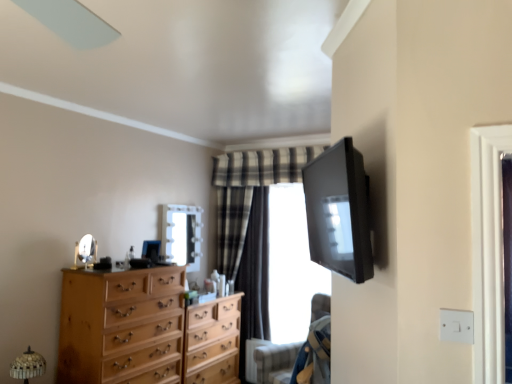
What do you see at coordinates (275, 362) in the screenshot? The image size is (512, 384). I see `denim fabric armchair at lower right` at bounding box center [275, 362].

What do you see at coordinates (339, 211) in the screenshot? I see `matte black tv at upper right` at bounding box center [339, 211].

The image size is (512, 384). What do you see at coordinates (122, 326) in the screenshot?
I see `wooden dresser at left, which is the 1th chest of drawers in front-to-back order` at bounding box center [122, 326].

This screenshot has height=384, width=512. I want to click on clear glass window at center, so (x=291, y=265).

The width and height of the screenshot is (512, 384). What do you see at coordinates (255, 270) in the screenshot? I see `plaid fabric curtain at center` at bounding box center [255, 270].

Find the location of `silver/metallic mirror at center-left, which is the 2th mirror in back-to-front order`. silver/metallic mirror at center-left, which is the 2th mirror in back-to-front order is located at coordinates [x=87, y=249].

Find the location of `curtain located above the light wood chest of drawers at center, the second chest of drawers in the front-to-back sequence (from the image's perspective)`. curtain located above the light wood chest of drawers at center, the second chest of drawers in the front-to-back sequence (from the image's perspective) is located at coordinates (255, 270).

Is plaid fabric curtain at center in contact with light wood chest of drawers at center, the second chest of drawers in the front-to-back sequence?

There is a gap between plaid fabric curtain at center and light wood chest of drawers at center, the second chest of drawers in the front-to-back sequence.

In the scene shown: Is plaid fabric curtain at center smaller than light wood chest of drawers at center, positioned as the first chest of drawers in back-to-front order?

Yes.

How different are the orientations of plaid fabric curtain at center and light wood chest of drawers at center, the second chest of drawers in the front-to-back sequence, in degrees?

The facing directions of plaid fabric curtain at center and light wood chest of drawers at center, the second chest of drawers in the front-to-back sequence, are 92.1 degrees apart.

Can you confirm if matte glass mirror at center, which is counted as the first mirror, starting from the back, is positioned to the left of plaid fabric curtain at center?

Correct, you'll find matte glass mirror at center, which is counted as the first mirror, starting from the back, to the left of plaid fabric curtain at center.

Considering the sizes of objects matte glass mirror at center, arranged as the first mirror when viewed from the right, and plaid fabric curtain at center in the image provided, who is smaller, matte glass mirror at center, arranged as the first mirror when viewed from the right, or plaid fabric curtain at center?

matte glass mirror at center, arranged as the first mirror when viewed from the right.

Is matte glass mirror at center, arranged as the first mirror when viewed from the right, located outside plaid fabric curtain at center?

Yes, matte glass mirror at center, arranged as the first mirror when viewed from the right, is not within plaid fabric curtain at center.

From a real-world perspective, which object stands above the other?

matte glass mirror at center, which is counted as the first mirror, starting from the back, is physically above.

From the image's perspective, is denim fabric armchair at lower right located above clear glass window at center?

Incorrect, from the image's perspective, denim fabric armchair at lower right is lower than clear glass window at center.

Are denim fabric armchair at lower right and clear glass window at center located far from each other?

No, denim fabric armchair at lower right is not far away from clear glass window at center.

Is point (319, 312) farther from viewer compared to point (318, 275)?

No, (319, 312) is in front of (318, 275).

Is clear glass window at center at the back of denim fabric armchair at lower right?

That's not correct — denim fabric armchair at lower right is not looking away from clear glass window at center.

What's the angular difference between denim fabric armchair at lower right and wooden dresser at left, the second chest of drawers viewed from the back,'s facing directions?

They differ by 178 degrees in their facing directions.

Measure the distance between denim fabric armchair at lower right and wooden dresser at left, the second chest of drawers viewed from the back.

denim fabric armchair at lower right is 3.53 feet away from wooden dresser at left, the second chest of drawers viewed from the back.

Can you confirm if denim fabric armchair at lower right is positioned to the left of wooden dresser at left, which is the 1th chest of drawers in front-to-back order?

In fact, denim fabric armchair at lower right is to the right of wooden dresser at left, which is the 1th chest of drawers in front-to-back order.

Between denim fabric armchair at lower right and wooden dresser at left, which is the 1th chest of drawers in front-to-back order, which one has larger width?

wooden dresser at left, which is the 1th chest of drawers in front-to-back order.

From a real-world perspective, is plaid fabric curtain at center positioned above or below silver/metallic mirror at center-left, the second mirror when ordered from right to left?

plaid fabric curtain at center is situated lower than silver/metallic mirror at center-left, the second mirror when ordered from right to left, in the real world.

Is plaid fabric curtain at center closer to camera compared to silver/metallic mirror at center-left, which is the 2th mirror in back-to-front order?

That is False.

In the scene shown: Can you confirm if plaid fabric curtain at center is wider than silver/metallic mirror at center-left, which is the 2th mirror in back-to-front order?

Indeed, plaid fabric curtain at center has a greater width compared to silver/metallic mirror at center-left, which is the 2th mirror in back-to-front order.

Would you say plaid fabric curtain at center is to the left or to the right of silver/metallic mirror at center-left, the second mirror when ordered from right to left, in the picture?

plaid fabric curtain at center is positioned on silver/metallic mirror at center-left, the second mirror when ordered from right to left,'s right side.

Would you say plaid fabric curtain at center is a long distance from matte glass mirror at center, the 2th mirror positioned from the front?

No, plaid fabric curtain at center is in close proximity to matte glass mirror at center, the 2th mirror positioned from the front.

From their relative heights in the image, would you say plaid fabric curtain at center is taller or shorter than matte glass mirror at center, the 2th mirror positioned from the front?

Clearly, plaid fabric curtain at center is taller compared to matte glass mirror at center, the 2th mirror positioned from the front.

In the scene shown: Based on their sizes in the image, would you say plaid fabric curtain at center is bigger or smaller than matte glass mirror at center, the 2th mirror in the left-to-right sequence?

Considering their sizes, plaid fabric curtain at center takes up more space than matte glass mirror at center, the 2th mirror in the left-to-right sequence.

Identify the location of the 1st mirror to the left of the plaid fabric curtain at center, starting your count from the anchor. This screenshot has width=512, height=384. (182, 235).

From the image's perspective, is clear glass window at center above wooden dresser at left, which is the 1th chest of drawers in front-to-back order?

Yes, from the image's perspective, clear glass window at center is over wooden dresser at left, which is the 1th chest of drawers in front-to-back order.

How many degrees apart are the facing directions of clear glass window at center and wooden dresser at left, which is the 1th chest of drawers in front-to-back order?

The angle between the facing direction of clear glass window at center and the facing direction of wooden dresser at left, which is the 1th chest of drawers in front-to-back order, is 91.8 degrees.

Is clear glass window at center oriented towards wooden dresser at left, the second chest of drawers viewed from the back?

Yes, clear glass window at center is aimed at wooden dresser at left, the second chest of drawers viewed from the back.

This screenshot has width=512, height=384. I want to click on the 1st chest of drawers to the left of the plaid fabric curtain at center, starting your count from the anchor, so click(x=213, y=341).

The height and width of the screenshot is (384, 512). Identify the location of the 1st mirror above the plaid fabric curtain at center (from the image's perspective). (182, 235).

Estimate the real-world distances between objects in this image. Which object is further from matte black tv at upper right, plaid fabric curtain at center or light wood chest of drawers at center, positioned as the first chest of drawers in back-to-front order?

plaid fabric curtain at center lies further to matte black tv at upper right than the other object.

Based on their spatial positions, is matte black tv at upper right or plaid fabric curtain at center closer to clear glass window at center?

Based on the image, plaid fabric curtain at center appears to be nearer to clear glass window at center.

When comparing their distances from plaid fabric curtain at center, does matte black tv at upper right or clear glass window at center seem closer?

The object closer to plaid fabric curtain at center is clear glass window at center.

Based on their spatial positions, is matte black tv at upper right or silver/metallic mirror at center-left, the second mirror when ordered from right to left, closer to clear glass window at center?

silver/metallic mirror at center-left, the second mirror when ordered from right to left.

From the image, which object appears to be farther from clear glass window at center, wooden dresser at left, the second chest of drawers viewed from the back, or matte black tv at upper right?

matte black tv at upper right lies further to clear glass window at center than the other object.

Which object lies nearer to the anchor point light wood chest of drawers at center, positioned as the first chest of drawers in back-to-front order, wooden dresser at left, which is the 1th chest of drawers in front-to-back order, or matte black tv at upper right?

wooden dresser at left, which is the 1th chest of drawers in front-to-back order, is closer to light wood chest of drawers at center, positioned as the first chest of drawers in back-to-front order.

Looking at the image, which one is located closer to matte black tv at upper right, denim fabric armchair at lower right or silver/metallic mirror at center-left, positioned as the 1th mirror in front-to-back order?

denim fabric armchair at lower right is positioned closer to the anchor matte black tv at upper right.

Based on their spatial positions, is matte glass mirror at center, which is counted as the first mirror, starting from the back, or denim fabric armchair at lower right further from plaid fabric curtain at center?

denim fabric armchair at lower right.

Where is `armchair between matte black tv at upper right and clear glass window at center along the z-axis`? The image size is (512, 384). armchair between matte black tv at upper right and clear glass window at center along the z-axis is located at coordinates (275, 362).

I want to click on mirror between wooden dresser at left, which is the 1th chest of drawers in front-to-back order, and matte glass mirror at center, arranged as the first mirror when viewed from the right, from front to back, so click(87, 249).

Locate an element on the screen. armchair between matte black tv at upper right and light wood chest of drawers at center, the second chest of drawers in the front-to-back sequence, from front to back is located at coordinates (275, 362).

What are the coordinates of `chest of drawers between matte black tv at upper right and silver/metallic mirror at center-left, which appears as the 1th mirror when viewed from the left, in the front-back direction` in the screenshot? It's located at (122, 326).